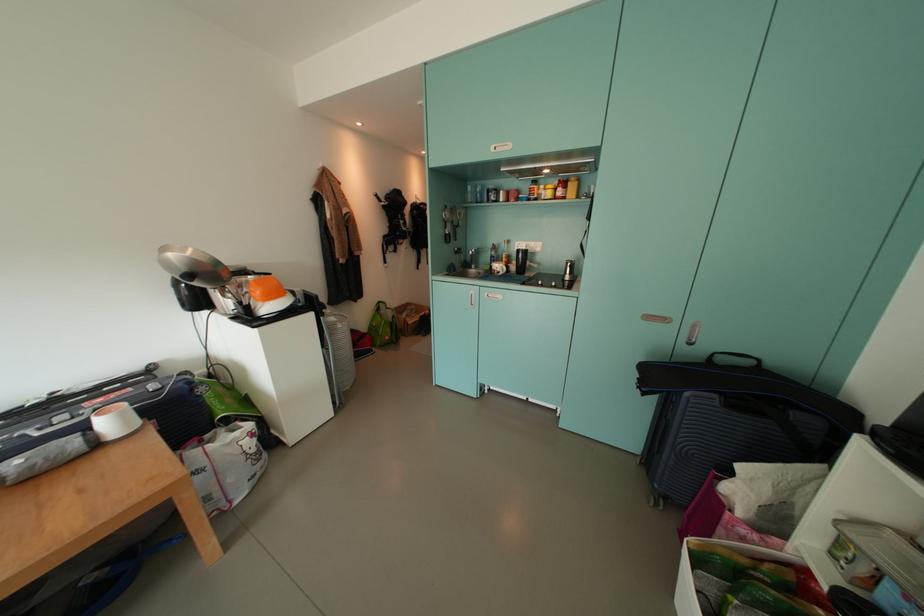
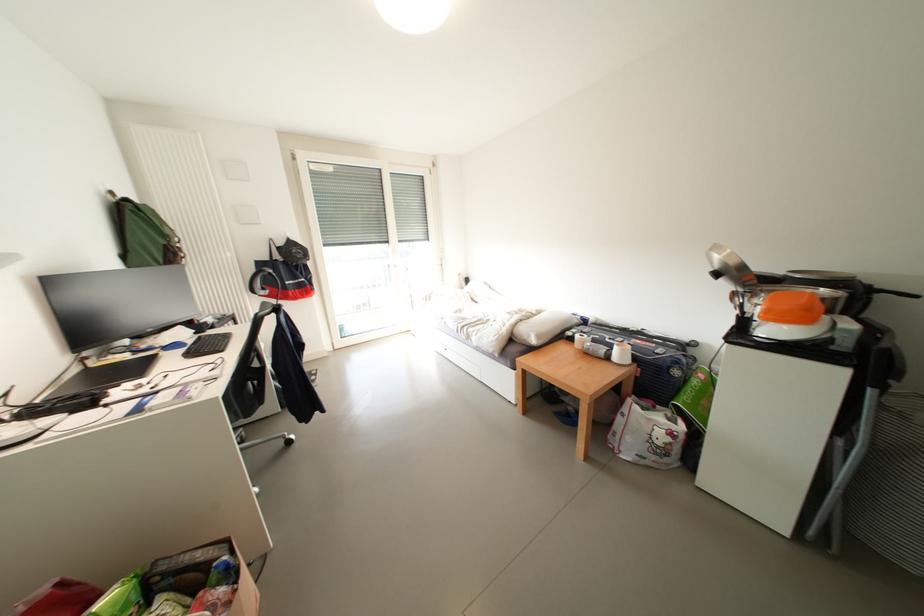
In the second image, find the point that corresponds to point 45,437 in the first image.

(614, 342)